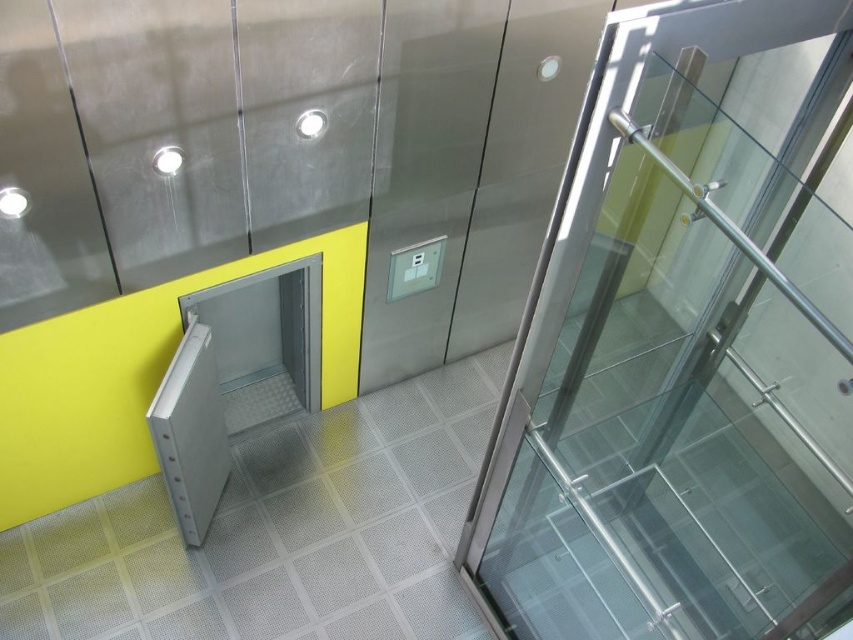
Is point (791, 346) behind point (216, 442)?

No, (791, 346) is closer to viewer.

Between transparent glass door at center and white matte lift door at center, which one appears on the left side from the viewer's perspective?

Positioned to the left is white matte lift door at center.

Between point (602, 492) and point (202, 348), which one is positioned behind?

Positioned behind is point (202, 348).

Where is `transparent glass door at center`? The height and width of the screenshot is (640, 853). transparent glass door at center is located at coordinates (686, 346).